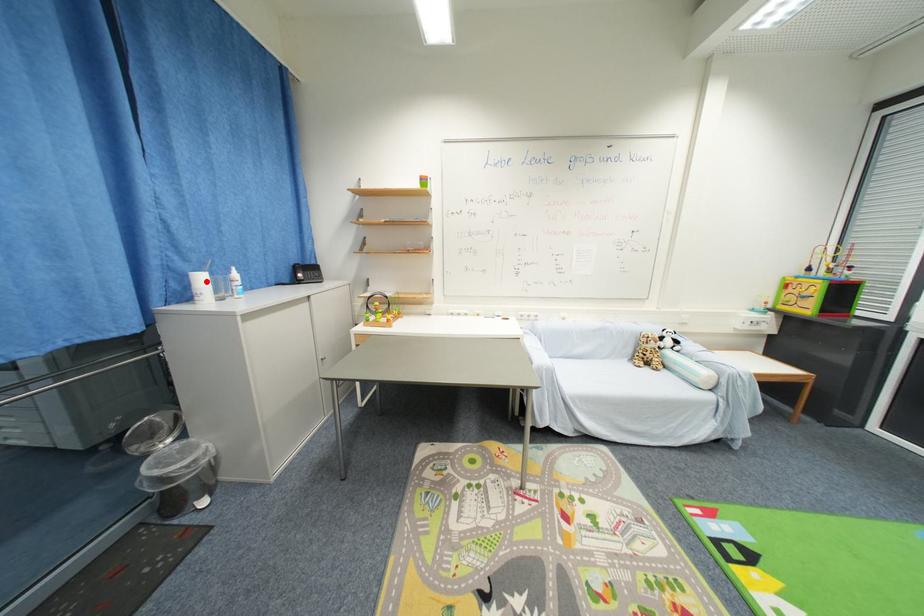
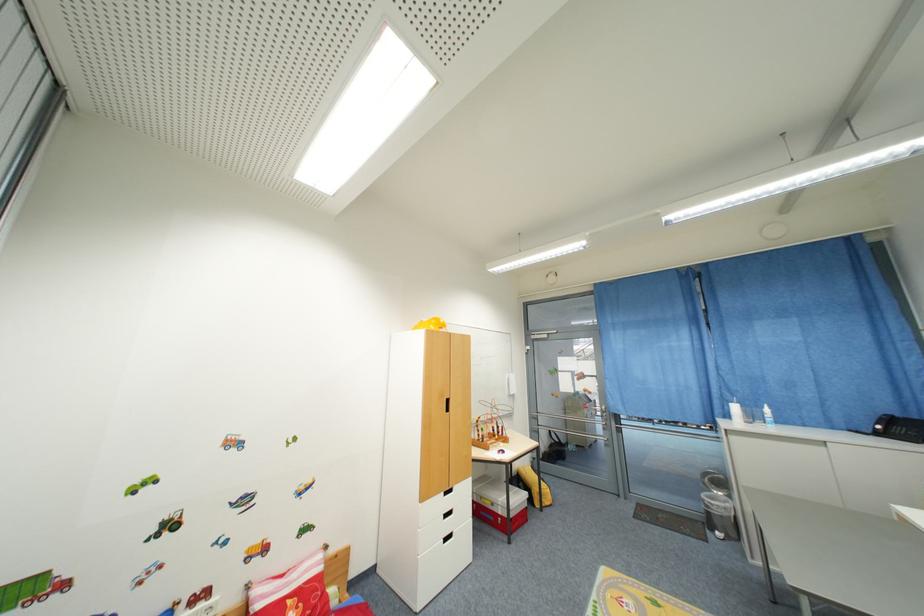
The point at the highlighted location is marked in the first image. Where is the corresponding point in the second image?

(740, 410)